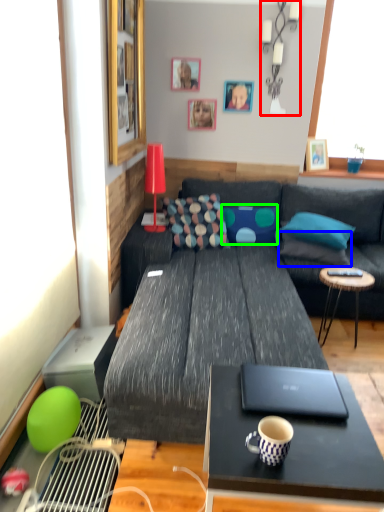
Question: Considering the real-world distances, which object is closest to lamp (highlighted by a red box)? pillow (highlighted by a blue box) or pillow (highlighted by a green box).

Choices:
 (A) pillow
 (B) pillow

Answer: (B)